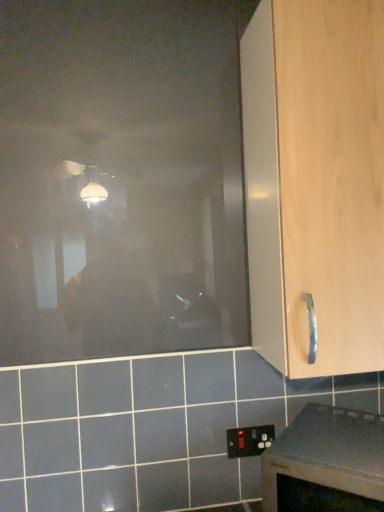
Question: Is light wood cabinet handle at right facing towards smooth gray countertop at lower right?

Choices:
 (A) no
 (B) yes

Answer: (A)

Question: Is light wood cabinet handle at right at the right side of smooth gray countertop at lower right?

Choices:
 (A) no
 (B) yes

Answer: (B)

Question: Is light wood cabinet handle at right smaller than smooth gray countertop at lower right?

Choices:
 (A) no
 (B) yes

Answer: (A)

Question: Is the position of light wood cabinet handle at right less distant than that of smooth gray countertop at lower right?

Choices:
 (A) no
 (B) yes

Answer: (A)

Question: Is light wood cabinet handle at right positioned beyond the bounds of smooth gray countertop at lower right?

Choices:
 (A) yes
 (B) no

Answer: (A)

Question: Considering the relative sizes of light wood cabinet handle at right and smooth gray countertop at lower right in the image provided, is light wood cabinet handle at right taller than smooth gray countertop at lower right?

Choices:
 (A) no
 (B) yes

Answer: (B)

Question: From a real-world perspective, is light wood cabinet handle at right physically below transparent matte glass door at upper left?

Choices:
 (A) yes
 (B) no

Answer: (A)

Question: Does light wood cabinet handle at right appear on the right side of transparent matte glass door at upper left?

Choices:
 (A) no
 (B) yes

Answer: (B)

Question: Is transparent matte glass door at upper left completely or partially inside light wood cabinet handle at right?

Choices:
 (A) no
 (B) yes

Answer: (A)

Question: Is light wood cabinet handle at right far away from transparent matte glass door at upper left?

Choices:
 (A) no
 (B) yes

Answer: (A)

Question: Does light wood cabinet handle at right lie behind transparent matte glass door at upper left?

Choices:
 (A) no
 (B) yes

Answer: (A)

Question: Can you confirm if light wood cabinet handle at right is taller than transparent matte glass door at upper left?

Choices:
 (A) yes
 (B) no

Answer: (B)

Question: Does black plastic electric outlet at lower center appear on the left side of smooth gray countertop at lower right?

Choices:
 (A) yes
 (B) no

Answer: (A)